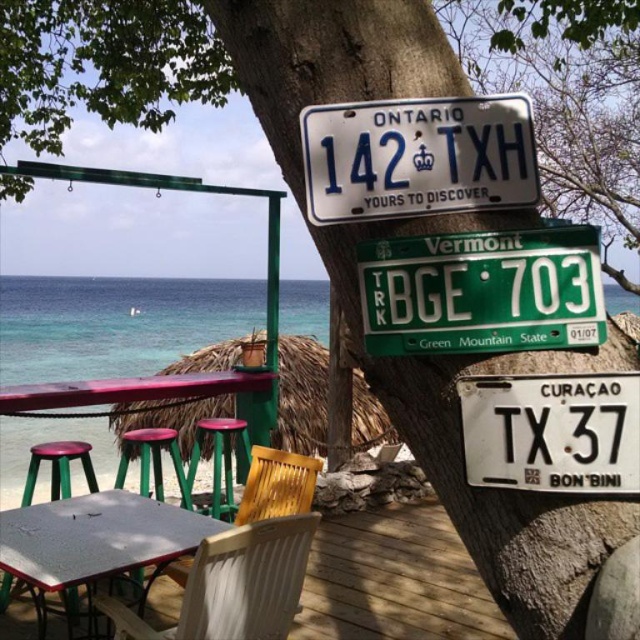
Question: Based on their relative distances, which object is nearer to the white plastic chair at lower center?

Choices:
 (A) green plastic stool at lower center
 (B) pink plastic stool at lower left
 (C) green matte license plate at center

Answer: (C)

Question: Does white matte license plate at center-right appear over white plastic table at lower left?

Choices:
 (A) no
 (B) yes

Answer: (B)

Question: Is white matte license plate at center-right to the left of pink plastic stool at lower left from the viewer's perspective?

Choices:
 (A) yes
 (B) no

Answer: (B)

Question: Which point appears closest to the camera in this image?

Choices:
 (A) (540, 310)
 (B) (60, 497)
 (C) (220, 426)
 (D) (602, 397)

Answer: (D)

Question: Is white plastic license plate at upper center to the left of green plastic stool at lower left from the viewer's perspective?

Choices:
 (A) yes
 (B) no

Answer: (B)

Question: Which is nearer to the white plastic chair at lower center?

Choices:
 (A) pink plastic stool at lower left
 (B) wooden picnic table at lower left

Answer: (A)